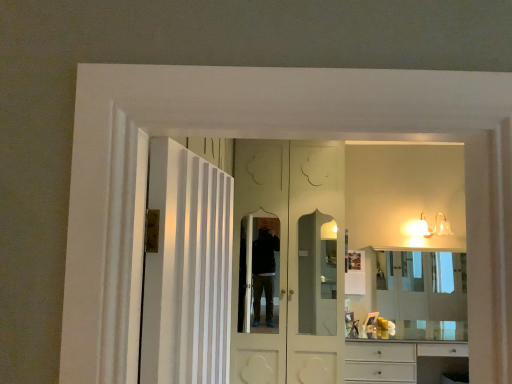
Image resolution: width=512 pixels, height=384 pixels. In order to click on vacant area on top of clear glass mirror at center (from a real-world perspective) in this screenshot , I will do `click(423, 250)`.